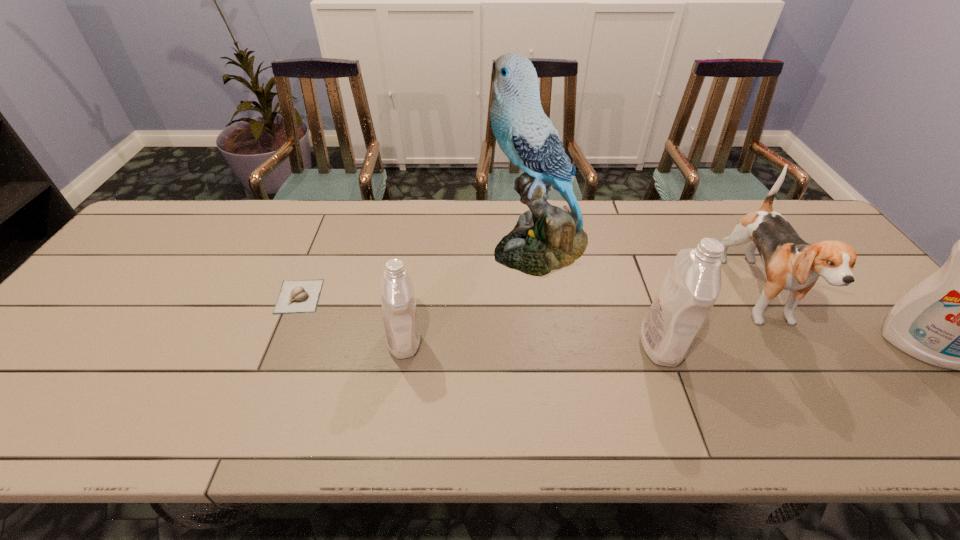
Please point a vacant point for placing a detergent on the left. Please provide its 2D coordinates. Your answer should be formatted as a tuple, i.e. [(x, y)], where the tuple contains the x and y coordinates of a point satisfying the conditions above.

[(150, 338)]